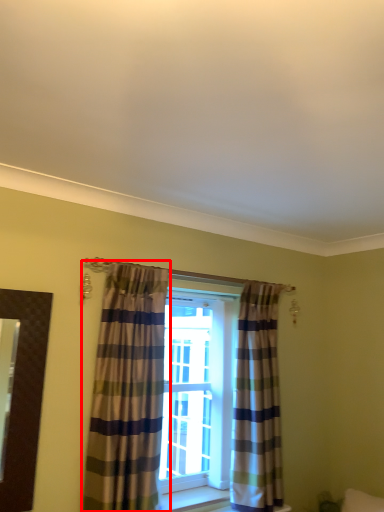
Question: From the image, what is the correct spatial relationship of curtain (annotated by the red box) in relation to curtain?

Choices:
 (A) right
 (B) left

Answer: (B)